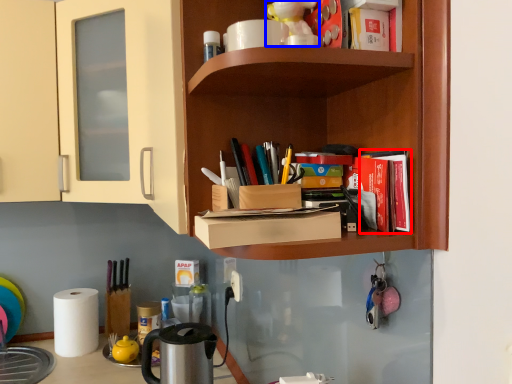
Question: Which point is further to the camera, book (highlighted by a red box) or toy (highlighted by a blue box)?

Choices:
 (A) book
 (B) toy

Answer: (B)